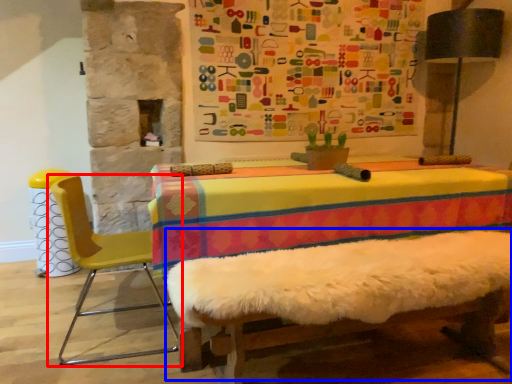
Question: Which of the following is the closest to the observer, chair (highlighted by a red box) or bed frame (highlighted by a blue box)?

Choices:
 (A) chair
 (B) bed frame

Answer: (B)